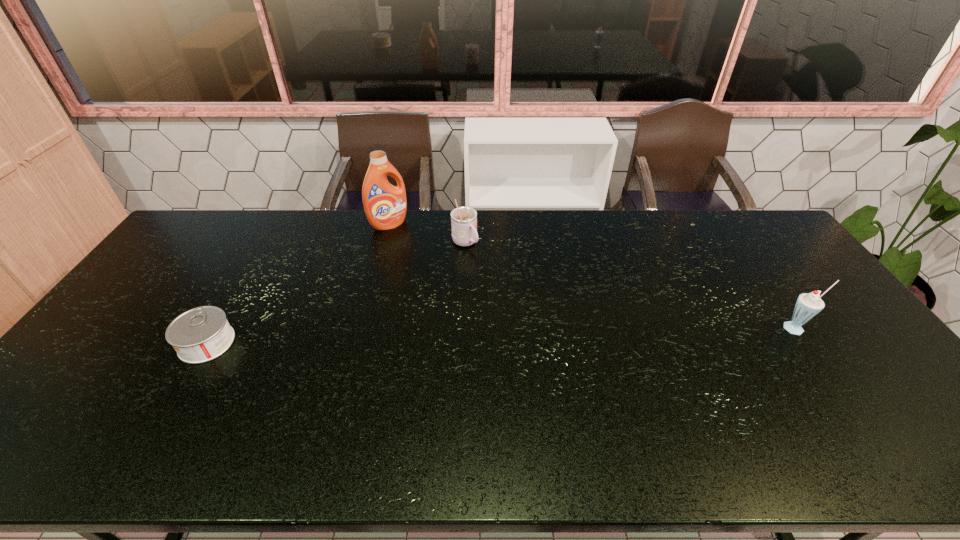
I want to click on vacant space that's between the rightmost object and the shortest object, so click(502, 335).

At what (x,y) coordinates should I click in order to perform the action: click on vacant space that is in between the rightmost object and the farthest object. Please return your answer as a coordinate pair (x, y). The height and width of the screenshot is (540, 960). Looking at the image, I should click on (593, 276).

Locate an element on the screen. object that is the second closest to the tallest object is located at coordinates (202, 334).

Identify the location of the second closest object relative to the rightmost object. Image resolution: width=960 pixels, height=540 pixels. (385, 205).